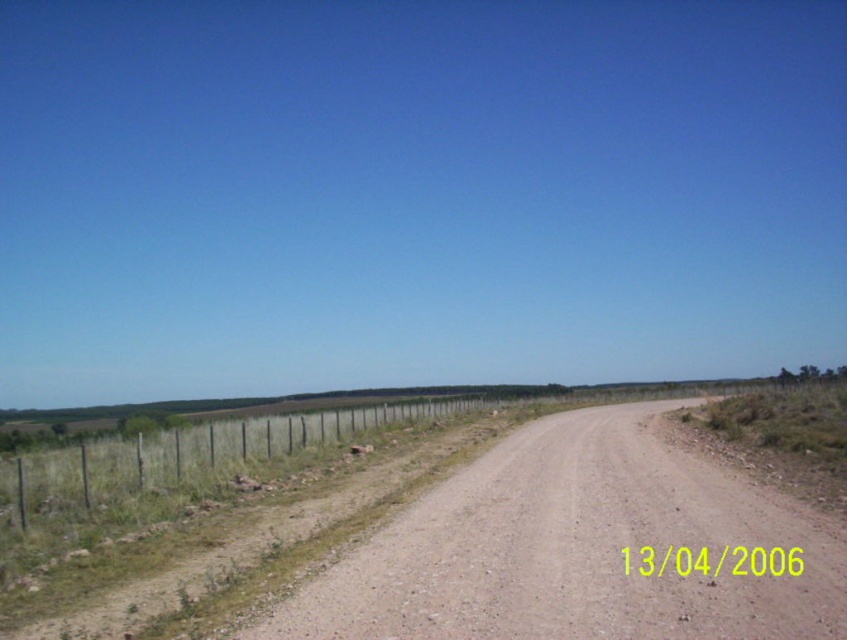
Question: Which point appears farthest from the camera in this image?

Choices:
 (A) (513, 499)
 (B) (126, 497)

Answer: (B)

Question: Is brown gravel dirt track at center to the left of metal wire fence at left from the viewer's perspective?

Choices:
 (A) no
 (B) yes

Answer: (A)

Question: Which of the following is the closest to the observer?

Choices:
 (A) (170, 468)
 (B) (794, 588)

Answer: (B)

Question: From the image, what is the correct spatial relationship of brown gravel dirt track at center in relation to metal wire fence at left?

Choices:
 (A) below
 (B) above

Answer: (B)

Question: Which object appears closest to the camera in this image?

Choices:
 (A) brown gravel dirt track at center
 (B) metal wire fence at left

Answer: (A)

Question: Is brown gravel dirt track at center positioned behind metal wire fence at left?

Choices:
 (A) yes
 (B) no

Answer: (B)